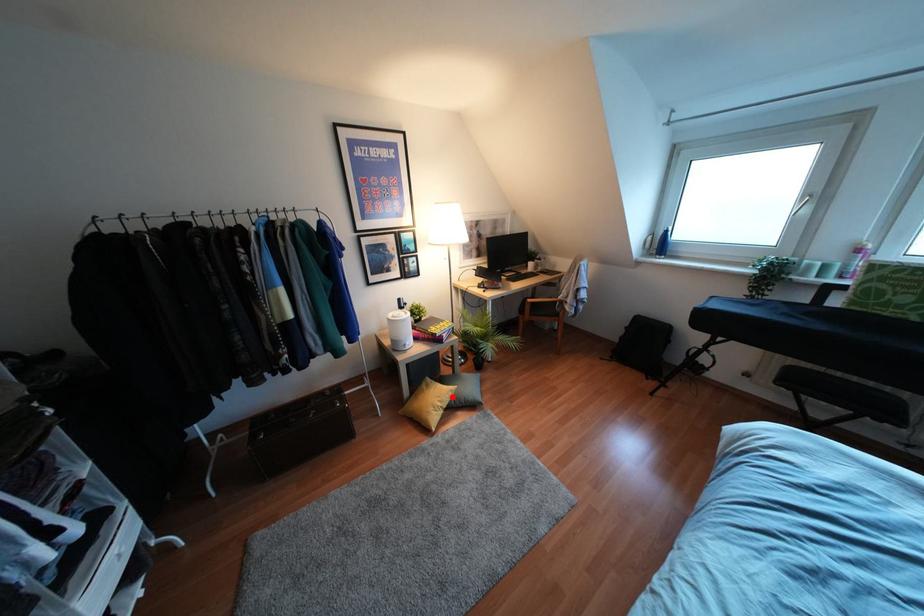
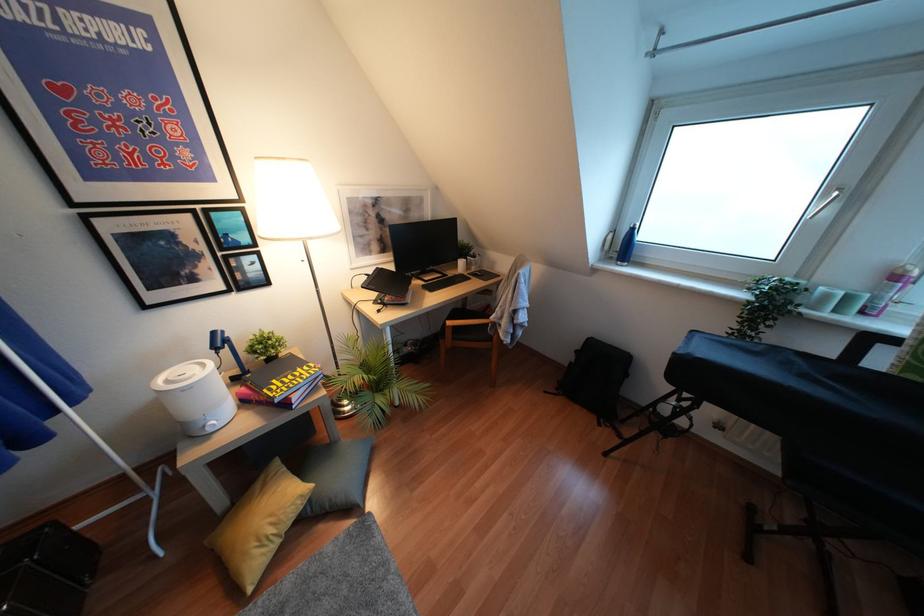
Locate, in the second image, the point that corresponds to the highlighted location in the first image.

(310, 500)